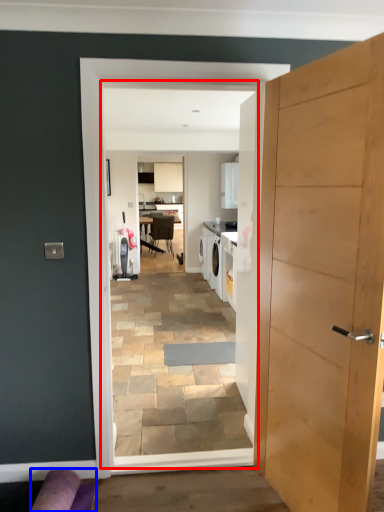
Question: Which object appears closest to the camera in this image, residence (highlighted by a red box) or couch (highlighted by a blue box)?

Choices:
 (A) residence
 (B) couch

Answer: (B)